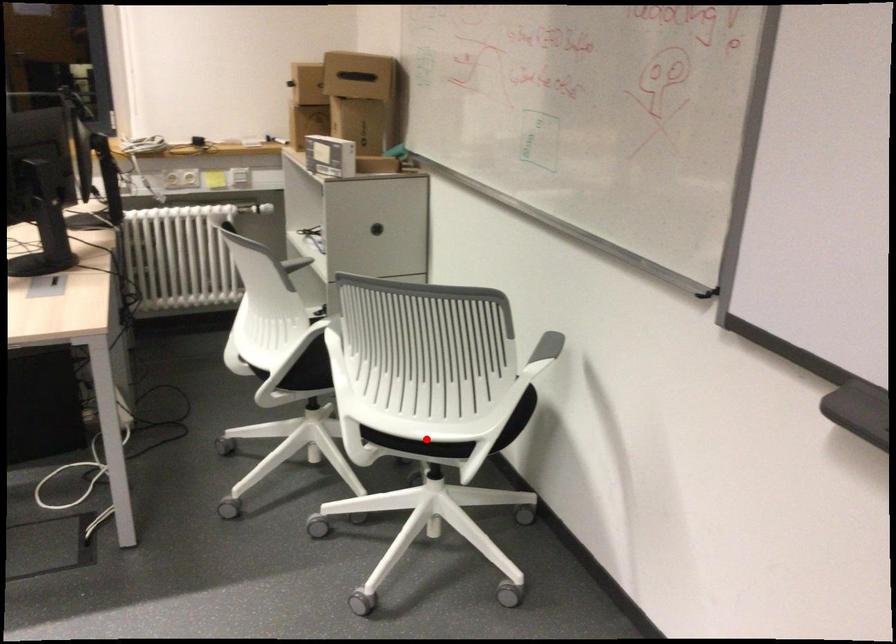
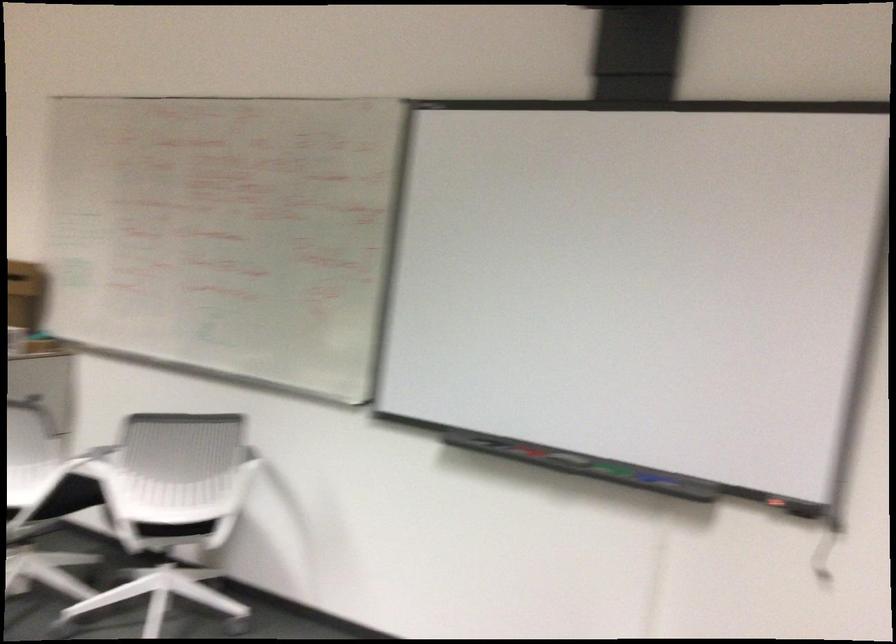
Question: I am providing you with two images of the same scene from different viewpoints. Image1 has a red point marked. In image2, the corresponding 3D location appears at what relative position? Reply with the corresponding letter.

Choices:
 (A) Closer
 (B) Farther

Answer: (B)